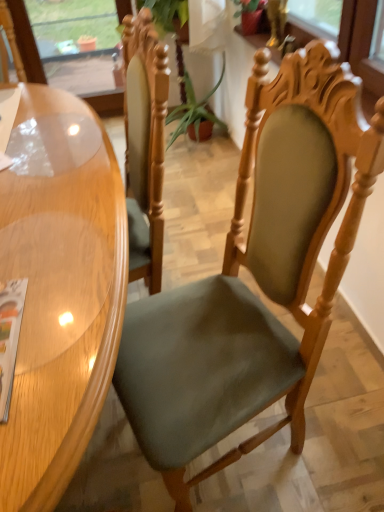
Locate an element on the screen. glossy wood table at left is located at coordinates (60, 308).

What are the coordinates of `matte paper magazine at lower left` in the screenshot? It's located at (9, 338).

The width and height of the screenshot is (384, 512). What do you see at coordinates (255, 276) in the screenshot?
I see `suede green chair at center` at bounding box center [255, 276].

Locate an element on the screen. The height and width of the screenshot is (512, 384). glossy wood table at left is located at coordinates (60, 308).

Is matte paper magazine at lower left not near transparent glass window screen at upper left?

matte paper magazine at lower left is positioned a significant distance from transparent glass window screen at upper left.

Consider the image. Is matte paper magazine at lower left situated inside transparent glass window screen at upper left or outside?

The correct answer is: outside.

Based on the photo, is matte paper magazine at lower left positioned with its back to transparent glass window screen at upper left?

No, matte paper magazine at lower left's orientation is not away from transparent glass window screen at upper left.

Is matte paper magazine at lower left wider than transparent glass window screen at upper left?

Indeed, matte paper magazine at lower left has a greater width compared to transparent glass window screen at upper left.

Considering the relative positions of green fabric plant at center and suede green chair at center in the image provided, is green fabric plant at center to the right of suede green chair at center from the viewer's perspective?

No.

From a real-world perspective, which object rests below the other?

From a 3D spatial view, green fabric plant at center is below.

Is green fabric plant at center not near suede green chair at center?

green fabric plant at center is positioned a significant distance from suede green chair at center.

Identify the location of chair below the green fabric plant at center (from the image's perspective). (255, 276).

This screenshot has height=512, width=384. I want to click on window screen that is behind the matte paper magazine at lower left, so click(x=76, y=42).

What's the angular difference between transparent glass window screen at upper left and matte paper magazine at lower left's facing directions?

The angle between the facing direction of transparent glass window screen at upper left and the facing direction of matte paper magazine at lower left is 179 degrees.

Considering the sizes of transparent glass window screen at upper left and matte paper magazine at lower left in the image, is transparent glass window screen at upper left wider or thinner than matte paper magazine at lower left?

transparent glass window screen at upper left is thinner than matte paper magazine at lower left.

Based on the photo, considering the sizes of objects green fabric plant at center and matte paper magazine at lower left in the image provided, who is thinner, green fabric plant at center or matte paper magazine at lower left?

matte paper magazine at lower left is thinner.

Is the position of green fabric plant at center less distant than that of matte paper magazine at lower left?

No, green fabric plant at center is further to the viewer.

Which is in front, point (168, 115) or point (12, 380)?

The point (12, 380) is closer to the camera.

Between point (177, 132) and point (58, 468), which one is positioned in front?

The point (58, 468) is closer to the camera.

Is green fabric plant at center oriented towards glossy wood table at left?

No, green fabric plant at center is not oriented towards glossy wood table at left.

Identify the location of plant below the glossy wood table at left (from a real-world perspective). This screenshot has width=384, height=512. (194, 110).

How different are the orientations of matte paper magazine at lower left and glossy wood table at left in degrees?

matte paper magazine at lower left and glossy wood table at left are facing 92.1 degrees away from each other.

From a real-world perspective, does matte paper magazine at lower left sit lower than glossy wood table at left?

No, from a real-world perspective, matte paper magazine at lower left is not under glossy wood table at left.

Is matte paper magazine at lower left situated inside glossy wood table at left or outside?

matte paper magazine at lower left can be found inside glossy wood table at left.

Consider the image. Considering the relative sizes of matte paper magazine at lower left and glossy wood table at left in the image provided, is matte paper magazine at lower left wider than glossy wood table at left?

In fact, matte paper magazine at lower left might be narrower than glossy wood table at left.

Considering the sizes of objects glossy wood table at left and transparent glass window screen at upper left in the image provided, who is shorter, glossy wood table at left or transparent glass window screen at upper left?

glossy wood table at left.

Is glossy wood table at left wider than transparent glass window screen at upper left?

Yes.

Does glossy wood table at left come in front of transparent glass window screen at upper left?

That is True.

From the image's perspective, would you say glossy wood table at left is positioned over transparent glass window screen at upper left?

No, from the image's perspective, glossy wood table at left is not on top of transparent glass window screen at upper left.

In the image, there is a transparent glass window screen at upper left. Where is `magazine below it (from the image's perspective)`? This screenshot has height=512, width=384. magazine below it (from the image's perspective) is located at coordinates (9, 338).

Identify the location of plant below the suede green chair at center (from a real-world perspective). Image resolution: width=384 pixels, height=512 pixels. (194, 110).

Based on their spatial positions, is transparent glass window screen at upper left or green fabric plant at center further from glossy wood table at left?

transparent glass window screen at upper left lies further to glossy wood table at left than the other object.

From the image, which object appears to be nearer to green fabric plant at center, glossy wood table at left or transparent glass window screen at upper left?

transparent glass window screen at upper left is positioned closer to the anchor green fabric plant at center.

Based on their spatial positions, is green fabric plant at center or matte paper magazine at lower left further from suede green chair at center?

green fabric plant at center.

In the scene shown: When comparing their distances from glossy wood table at left, does suede green chair at center or green fabric plant at center seem further?

Based on the image, green fabric plant at center appears to be further to glossy wood table at left.

Looking at the image, which one is located further to transparent glass window screen at upper left, green fabric plant at center or matte paper magazine at lower left?

Based on the image, matte paper magazine at lower left appears to be further to transparent glass window screen at upper left.

Estimate the real-world distances between objects in this image. Which object is closer to matte paper magazine at lower left, green fabric plant at center or glossy wood table at left?

glossy wood table at left is positioned closer to the anchor matte paper magazine at lower left.

From the image, which object appears to be farther from green fabric plant at center, suede green chair at center or transparent glass window screen at upper left?

The object further to green fabric plant at center is suede green chair at center.

When comparing their distances from transparent glass window screen at upper left, does green fabric plant at center or suede green chair at center seem further?

suede green chair at center lies further to transparent glass window screen at upper left than the other object.

You are a GUI agent. You are given a task and a screenshot of the screen. Output one action in this format:
    pyautogui.click(x=<x>, y=<y>)
    Task: Click on the magazine between glossy wood table at left and green fabric plant at center along the z-axis
    Image resolution: width=384 pixels, height=512 pixels.
    Given the screenshot: What is the action you would take?
    pyautogui.click(x=9, y=338)

This screenshot has height=512, width=384. Identify the location of chair between glossy wood table at left and transparent glass window screen at upper left along the z-axis. (255, 276).

What are the coordinates of `magazine positioned between glossy wood table at left and transparent glass window screen at upper left from near to far` in the screenshot? It's located at (9, 338).

At what (x,y) coordinates should I click in order to perform the action: click on plant positioned between matte paper magazine at lower left and transparent glass window screen at upper left from near to far. Please return your answer as a coordinate pair (x, y). Looking at the image, I should click on (194, 110).